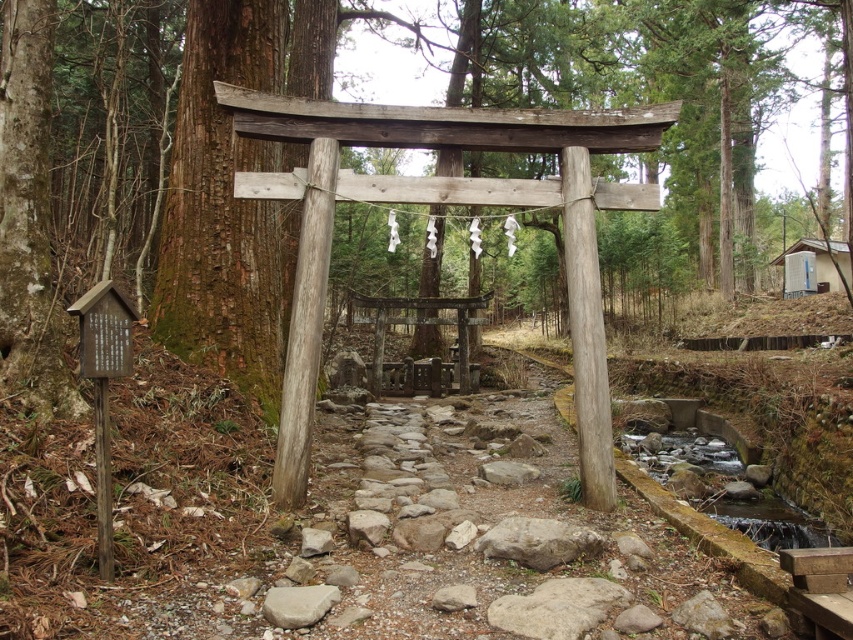
Question: Is gray rough rock at center to the left of smooth gray rock at lower center from the viewer's perspective?

Choices:
 (A) no
 (B) yes

Answer: (A)

Question: Does gray rough rock at center have a lesser width compared to smooth gray rock at lower center?

Choices:
 (A) yes
 (B) no

Answer: (B)

Question: Among these objects, which one is nearest to the camera?

Choices:
 (A) smooth gray rock at lower center
 (B) gray rough rock at center

Answer: (A)

Question: Can you confirm if gray rough rock at center is positioned to the right of smooth gray rock at lower center?

Choices:
 (A) yes
 (B) no

Answer: (A)

Question: Which of the following is the farthest from the observer?

Choices:
 (A) smooth gray rock at lower center
 (B) gray rough rock at center

Answer: (B)